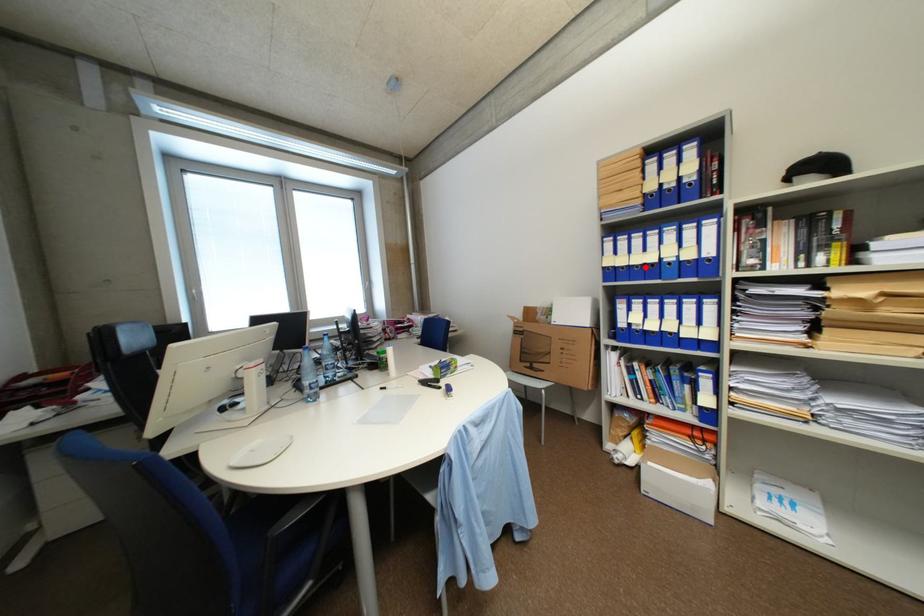
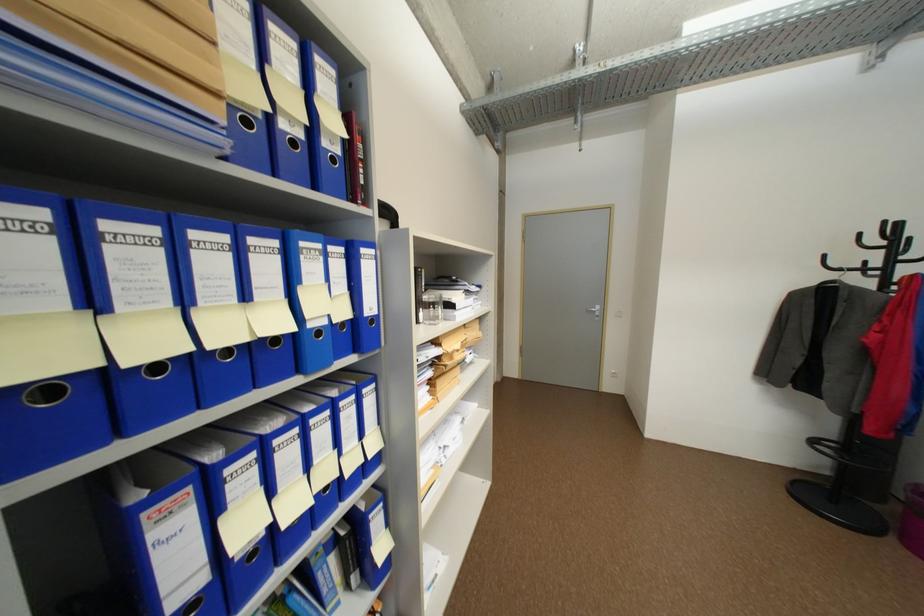
In the second image, find the point that corresponds to the highlighted location in the first image.

(236, 352)